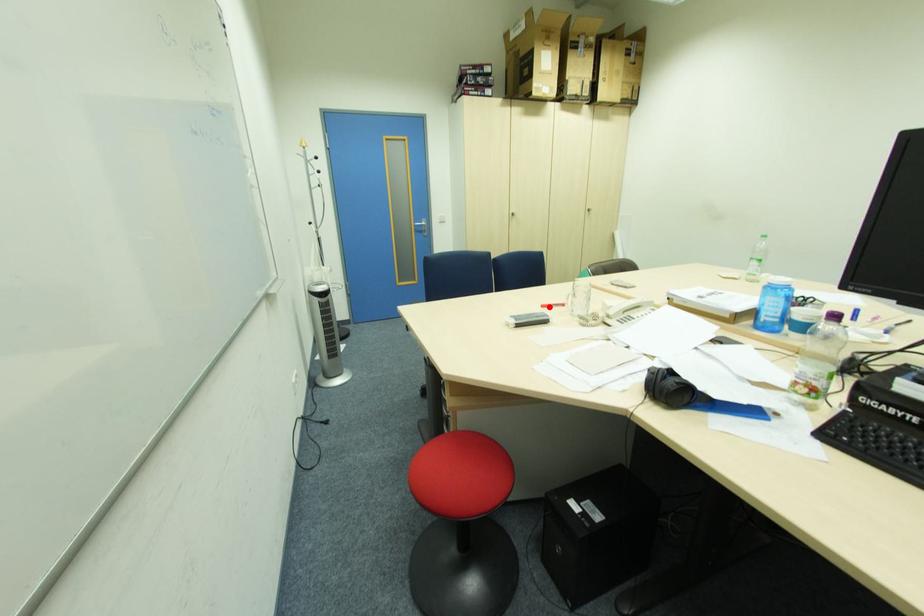
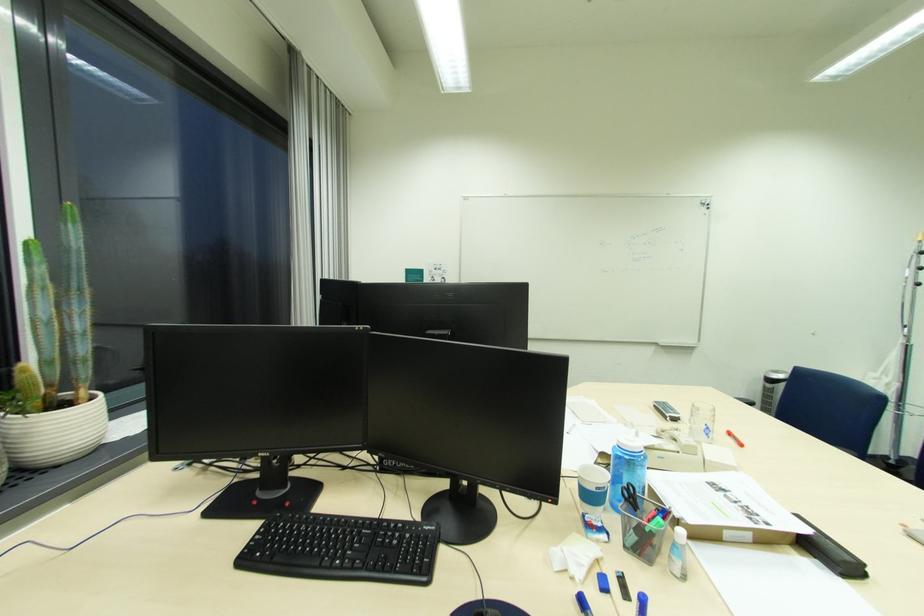
In the second image, find the point that corresponds to the highlighted location in the first image.

(736, 435)